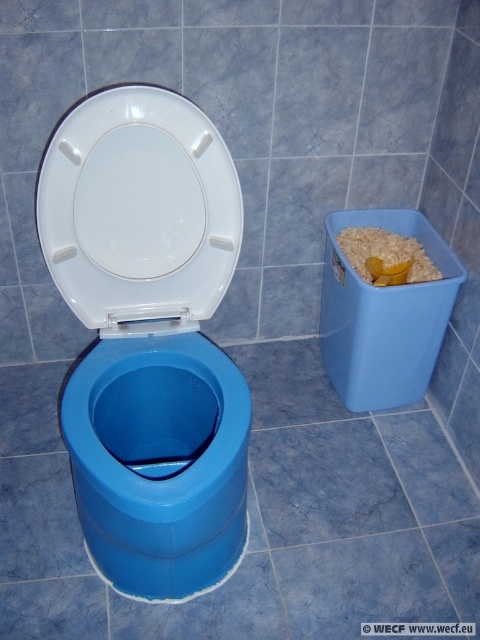
You are a guest in this bathroom and need to use the toilet. You notice the blue plastic toilet bowl at center and the white glossy toilet seat at center. Which one is positioned to the right side?

The blue plastic toilet bowl at center is to the right of the white glossy toilet seat at center.

You are designing a bathroom layout and need to place a blue plastic toilet bowl at center and a yellow plastic scoop at right. Considering their heights, which object should be placed lower to ensure proper functionality?

The yellow plastic scoop at right should be placed lower since the blue plastic toilet bowl at center is taller, so positioning the scoop lower would allow it to be easily accessible for use without obstructing the toilet.